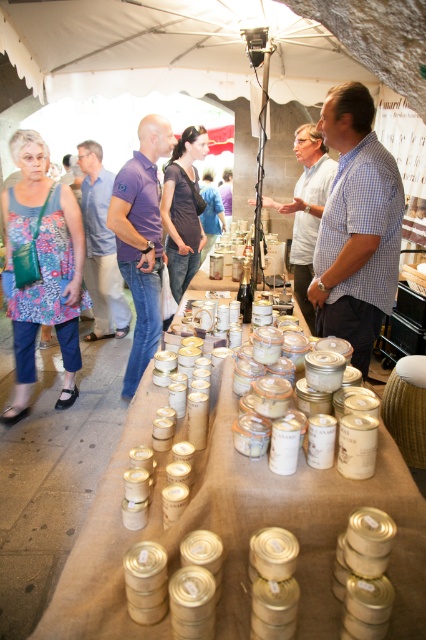
Question: Is floral fabric dress at left positioned behind purple cotton shirt at center?

Choices:
 (A) no
 (B) yes

Answer: (A)

Question: Based on their relative distances, which object is farther from the purple cotton polo shirt at center?

Choices:
 (A) dark brown leather jacket at center
 (B) floral fabric dress at left
 (C) checkered fabric shirt at center
 (D) purple cotton shirt at center

Answer: (D)

Question: Is checkered fabric shirt at center positioned behind matte white canister at center?

Choices:
 (A) no
 (B) yes

Answer: (A)

Question: Is floral fabric dress at left to the right of matte white canister at center from the viewer's perspective?

Choices:
 (A) yes
 (B) no

Answer: (B)

Question: Considering the real-world distances, which object is closest to the purple cotton shirt at center?

Choices:
 (A) matte white canister at center
 (B) floral fabric dress at left

Answer: (B)

Question: Which of the following is the farthest from the observer?

Choices:
 (A) (189, 168)
 (B) (92, 196)
 (C) (310, 188)
 (D) (157, 188)

Answer: (B)